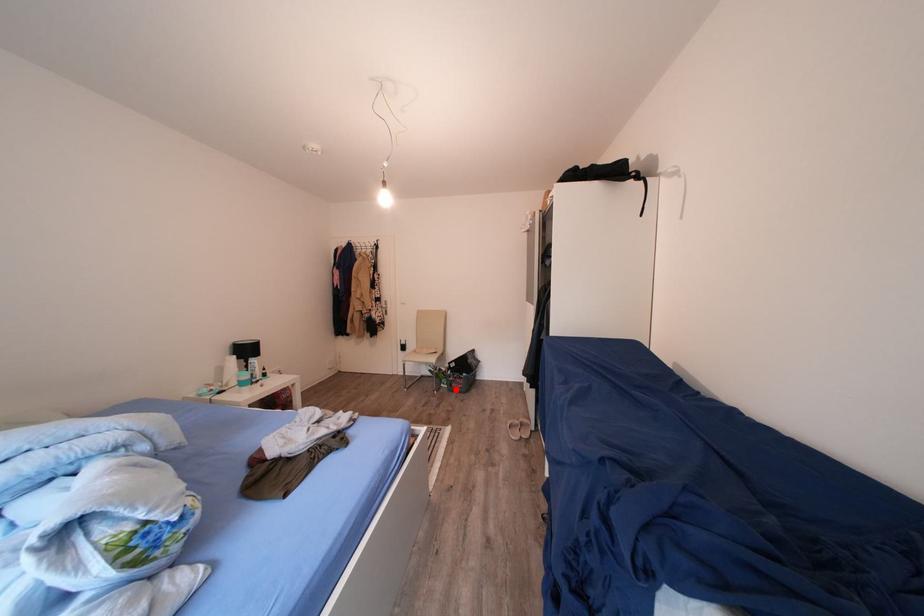
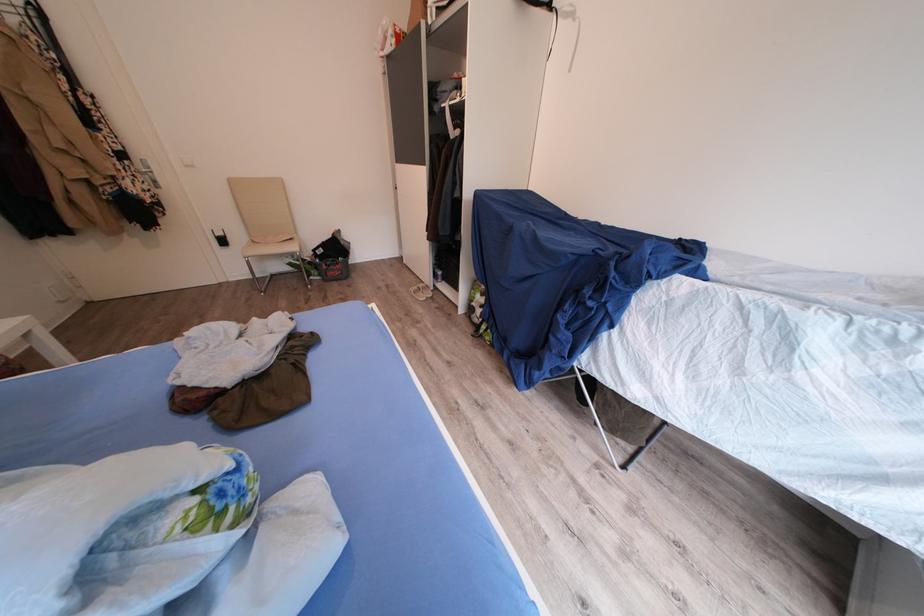
Question: A red point is marked in image1. In image2, is the corresponding 3D point closer to the camera or farther? Reply with the corresponding letter.

Choices:
 (A) The corresponding 3D point is closer.
 (B) The corresponding 3D point is farther.

Answer: (A)